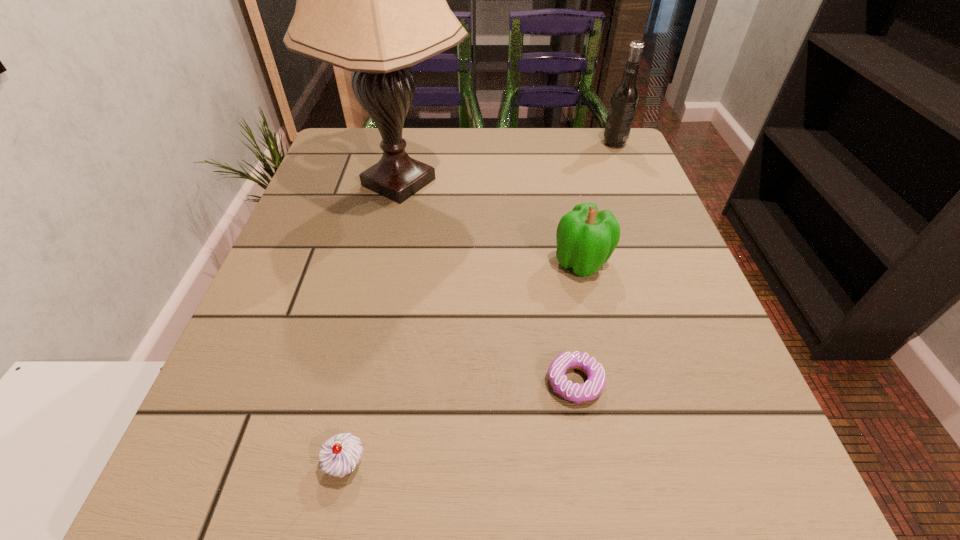
Find the location of a particular element. the tallest object is located at coordinates (371, 0).

Locate an element on the screen. The height and width of the screenshot is (540, 960). the rightmost object is located at coordinates (624, 99).

Identify the location of the second tallest object. (624, 99).

You are a GUI agent. You are given a task and a screenshot of the screen. Output one action in this format:
    pyautogui.click(x=<x>, y=<y>)
    Task: Click on the third farthest object
    The height and width of the screenshot is (540, 960).
    Given the screenshot: What is the action you would take?
    pyautogui.click(x=586, y=237)

You are a GUI agent. You are given a task and a screenshot of the screen. Output one action in this format:
    pyautogui.click(x=<x>, y=<y>)
    Task: Click on the bell pepper
    The height and width of the screenshot is (540, 960).
    Given the screenshot: What is the action you would take?
    click(x=586, y=237)

Find the location of `cupcake`. cupcake is located at coordinates (x=339, y=455).

Where is `the nearest object`? the nearest object is located at coordinates (339, 455).

Find the location of a particular element. The height and width of the screenshot is (540, 960). the fourth farthest object is located at coordinates (591, 389).

Locate an element on the screen. doughnut is located at coordinates 591,389.

Locate an element on the screen. The width and height of the screenshot is (960, 540). vacant space located on the right of the tallest object is located at coordinates (583, 183).